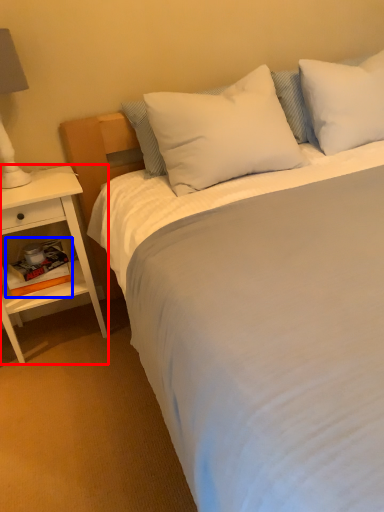
Question: Among these objects, which one is farthest to the camera, nightstand (highlighted by a red box) or book (highlighted by a blue box)?

Choices:
 (A) nightstand
 (B) book

Answer: (B)